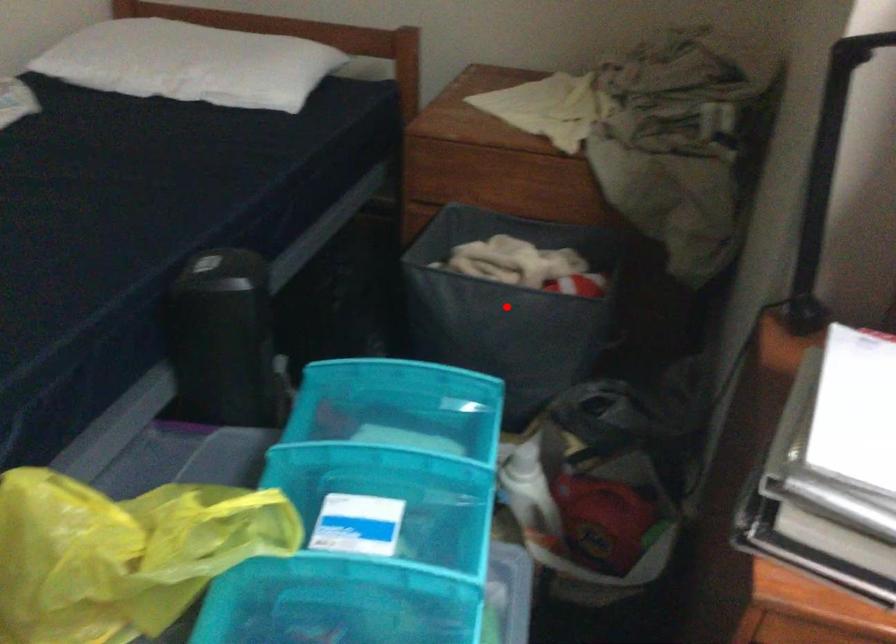
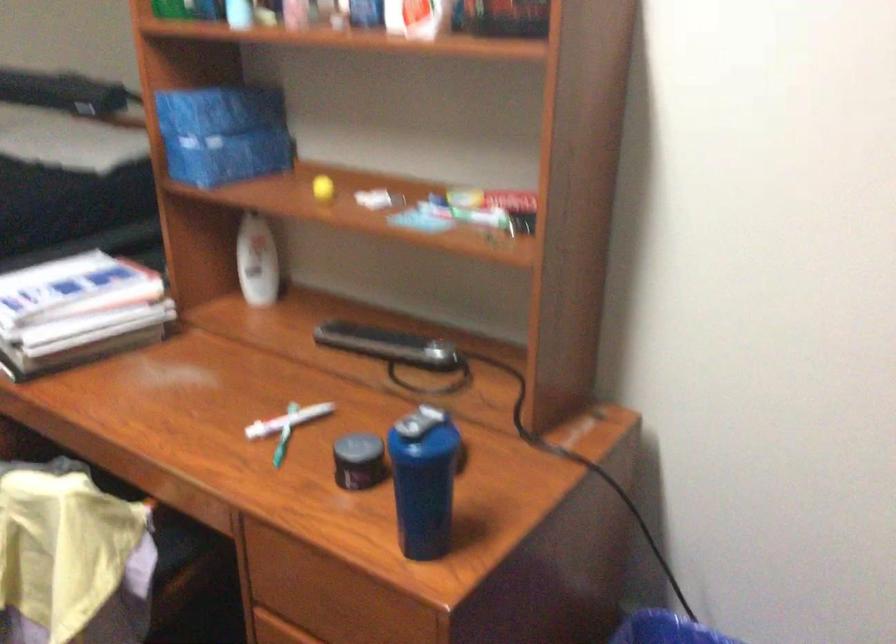
Question: I am providing you with two images of the same scene from different viewpoints. A red point is marked on the first image. Can you still see the location of the red point in image 2?

Choices:
 (A) Yes
 (B) No

Answer: (B)